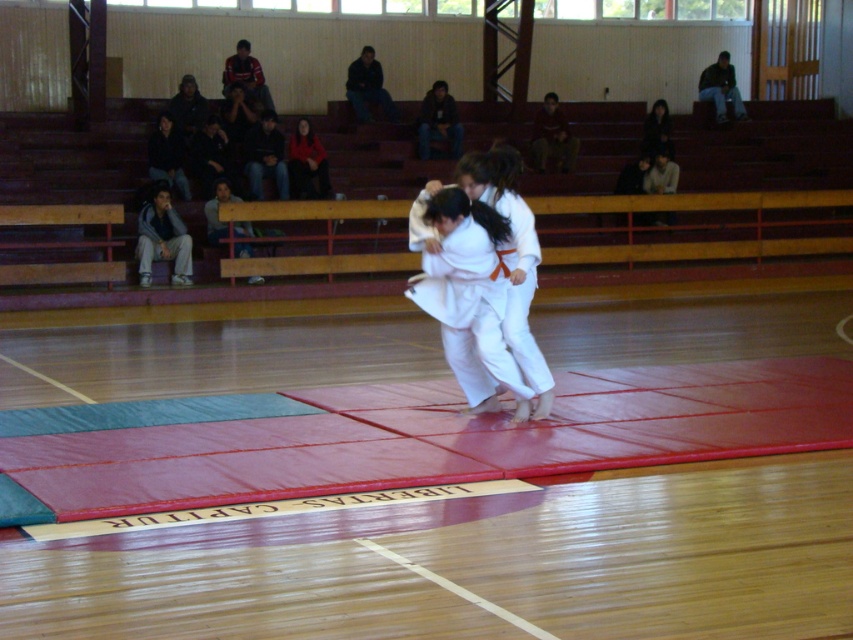
You are a photographer positioned at the back of the gymnasium. You need to take a photo of the judo practitioners without any obstructions. Considering the white cotton kimono at center and the dark brown hair at upper right, which object is taller and might block the view?

The white cotton kimono at center is taller than the dark brown hair at upper right, so it might block the view.

You are a photographer standing at the back of the gymnasium. You want to take a photo of the judo practitioners. Which object, the white cotton kimono at center or the dark brown hair at upper right, will appear larger in your photo?

The white cotton kimono at center will appear larger in the photo because it is closer to the viewer than the dark brown hair at upper right.

You are a photographer standing in the gymnasium and want to take a closeup photo of the white cotton kimono at center. The camera you have can focus on objects up to 30 feet away. Will the kimono be in focus?

The white cotton kimono at center is 29.90 feet from viewer, so the camera can focus on it since it is within the 30 feet range.